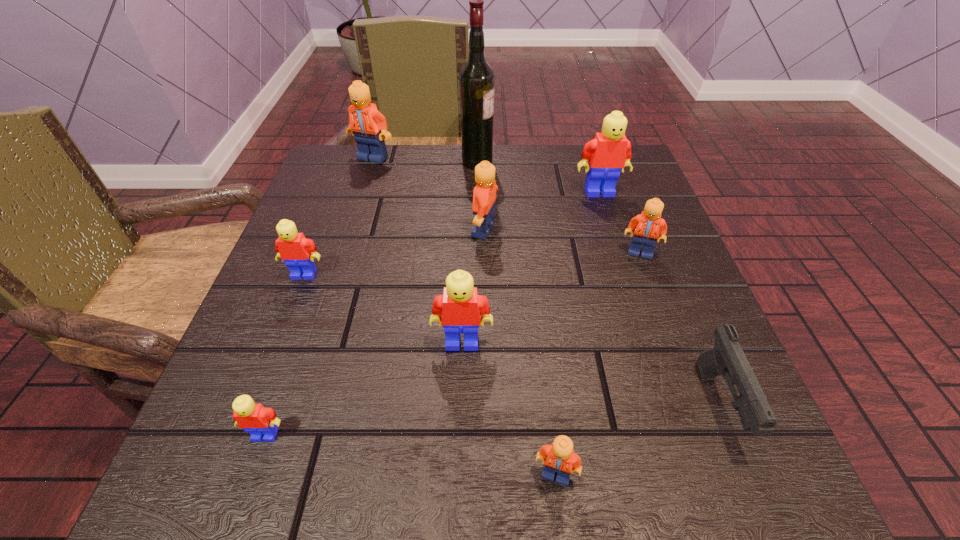
You are a GUI agent. You are given a task and a screenshot of the screen. Output one action in this format:
    pyautogui.click(x=<x>, y=<y>)
    Task: Click on the object present at the far left corner
    This screenshot has width=960, height=540.
    Given the screenshot: What is the action you would take?
    pyautogui.click(x=369, y=127)

Locate an element on the screen. object that is at the near left corner is located at coordinates (254, 418).

Where is `object that is positioned at the far right corner`? This screenshot has width=960, height=540. object that is positioned at the far right corner is located at coordinates (609, 152).

Locate an element on the screen. object present at the near right corner is located at coordinates pyautogui.click(x=727, y=358).

Find the location of a particular element. vacant region at the far edge is located at coordinates (466, 193).

Where is `vacant space at the near edge`? Image resolution: width=960 pixels, height=540 pixels. vacant space at the near edge is located at coordinates (439, 463).

I want to click on vacant region at the left edge, so [258, 386].

Identify the location of vacant region at the right edge of the desktop. (630, 223).

This screenshot has height=540, width=960. What are the coordinates of `free space at the far left corner of the desktop` in the screenshot? It's located at (370, 169).

You are a GUI agent. You are given a task and a screenshot of the screen. Output one action in this format:
    pyautogui.click(x=<x>, y=<y>)
    Task: Click on the free space at the near left corner of the desktop
    The height and width of the screenshot is (540, 960).
    Given the screenshot: What is the action you would take?
    pyautogui.click(x=274, y=494)